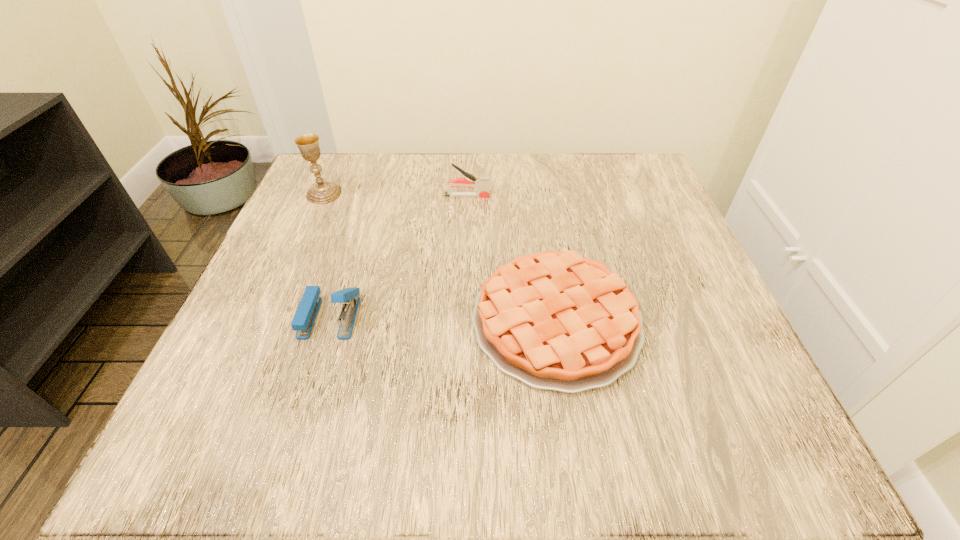
The image size is (960, 540). I want to click on the tallest object, so click(323, 192).

Image resolution: width=960 pixels, height=540 pixels. What are the coordinates of `the leftmost object` in the screenshot? It's located at (323, 192).

Locate an element on the screen. The image size is (960, 540). the farther stapler is located at coordinates (481, 183).

At what (x,y) coordinates should I click in order to perform the action: click on the third object from right to left. Please return your answer as a coordinate pair (x, y). Image resolution: width=960 pixels, height=540 pixels. Looking at the image, I should click on (304, 318).

The height and width of the screenshot is (540, 960). In order to click on the nearer stapler in this screenshot , I will do `click(304, 318)`.

Locate an element on the screen. This screenshot has width=960, height=540. pie is located at coordinates (554, 320).

The height and width of the screenshot is (540, 960). I want to click on vacant space located on the front of the tallest object, so click(x=269, y=320).

The width and height of the screenshot is (960, 540). What are the coordinates of `free space located on the handle side of the farther stapler` in the screenshot? It's located at (516, 196).

The width and height of the screenshot is (960, 540). Identify the location of vacant region located on the right of the second object from left to right. tap(564, 317).

You are a GUI agent. You are given a task and a screenshot of the screen. Output one action in this format:
    pyautogui.click(x=<x>, y=<y>)
    Task: Click on the vacant space situated 0.160m on the left of the pie
    The width and height of the screenshot is (960, 540).
    Given the screenshot: What is the action you would take?
    pyautogui.click(x=372, y=321)